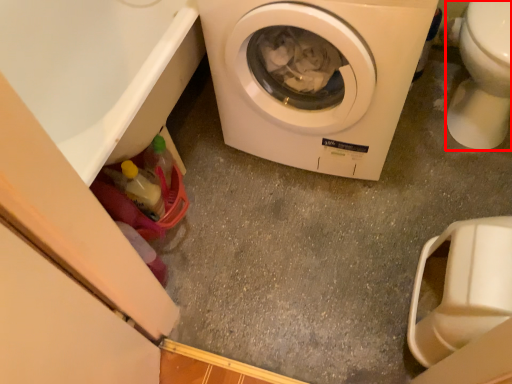
Question: Considering the relative positions of toilet bowl (annotated by the red box) and washing machine in the image provided, where is toilet bowl (annotated by the red box) located with respect to the staircase?

Choices:
 (A) right
 (B) left

Answer: (A)